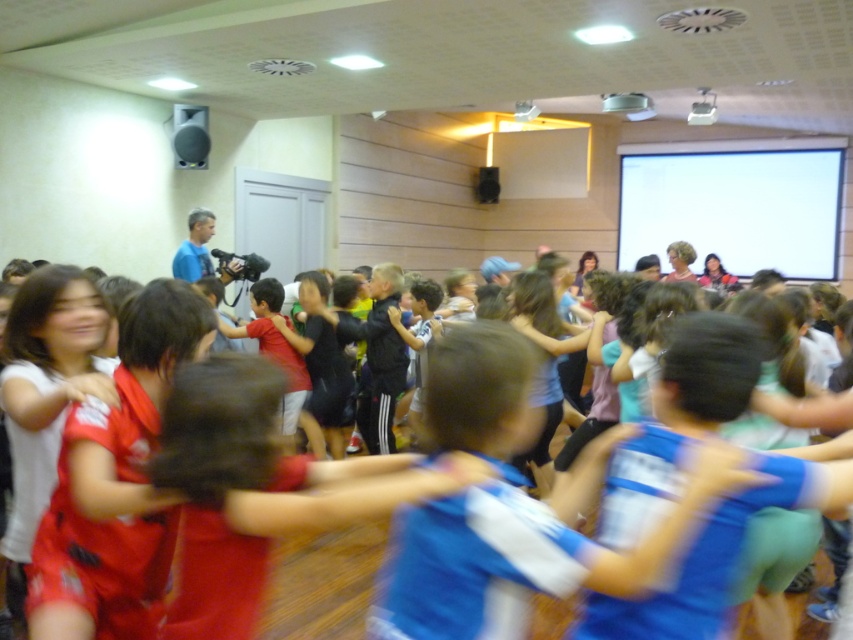
Question: Based on their relative distances, which object is farther from the metallic projector at upper center?

Choices:
 (A) white matte projection screen at upper right
 (B) matte black speaker at upper left
 (C) black plastic speaker at upper center
 (D) blue jersey at center

Answer: (D)

Question: Can you confirm if blue jersey at center is thinner than black plastic speaker at upper center?

Choices:
 (A) yes
 (B) no

Answer: (B)

Question: Among these points, which one is nearest to the camera?

Choices:
 (A) (196, 154)
 (B) (607, 108)
 (C) (495, 182)
 (D) (682, 227)

Answer: (A)

Question: Which object appears farthest from the camera in this image?

Choices:
 (A) white matte projection screen at upper right
 (B) black plastic speaker at upper center

Answer: (B)

Question: Observing the image, what is the correct spatial positioning of blue jersey at center in reference to black plastic speaker at upper center?

Choices:
 (A) right
 (B) left

Answer: (B)

Question: Does white matte projection screen at upper right appear on the left side of metallic projector at upper center?

Choices:
 (A) yes
 (B) no

Answer: (B)